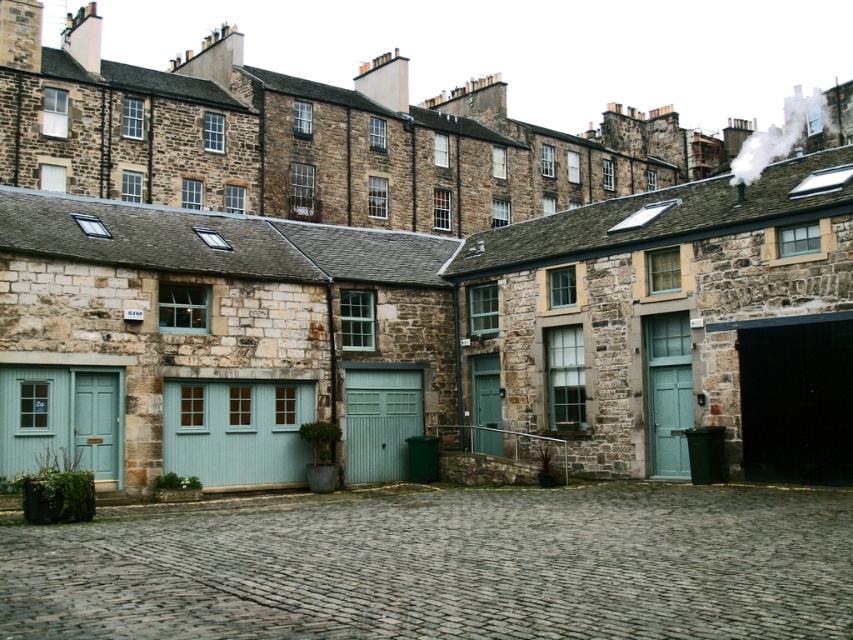
You are standing in the courtyard and need to reach both the light blue wooden garage door at center and the green corrugated metal garage door at center. Which door is closer to you?

Both the light blue wooden garage door at center and the green corrugated metal garage door at center are at the same distance from you since they are both located at the center of the courtyard.

You are designing a new pathway in the courtyard and want to ensure it aligns with the existing cobblestone at center. The pathway will be made of materials similar to the green corrugated metal garage door at center. Will the new pathway material need to be wider or narrower than the existing cobblestone to maintain visual harmony?

The cobblestone at center has a larger width than the green corrugated metal garage door at center. To maintain visual harmony, the new pathway material should be wider than the green corrugated metal garage door at center, matching the cobblestone at center.